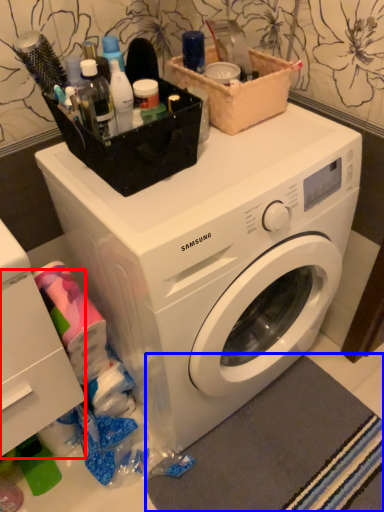
Question: Which object appears closest to the camera in this image, drawer (highlighted by a red box) or bath mat (highlighted by a blue box)?

Choices:
 (A) drawer
 (B) bath mat

Answer: (A)